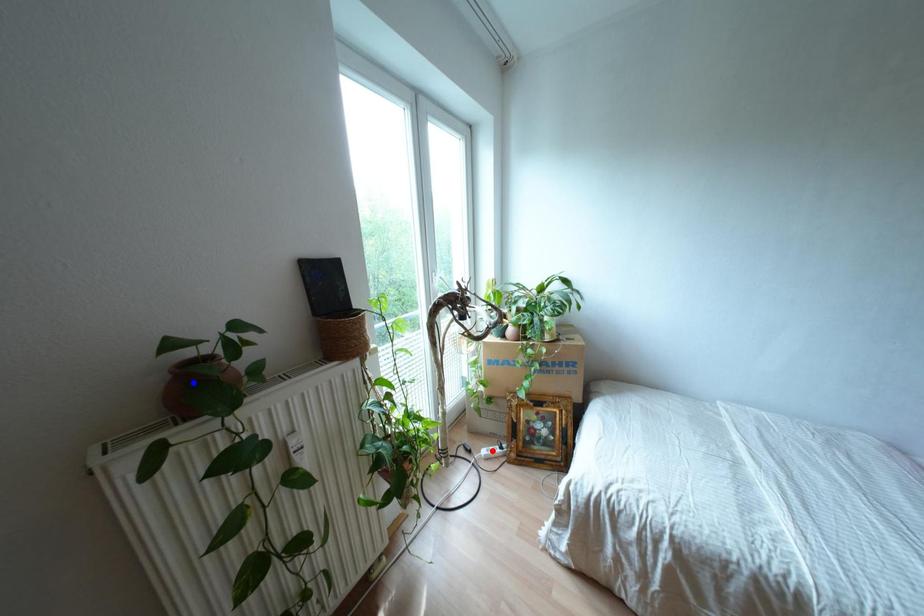
Question: In the image, two points are highlighted. Which point is nearer to the camera? Reply with the corresponding letter.

Choices:
 (A) blue point
 (B) red point

Answer: (A)